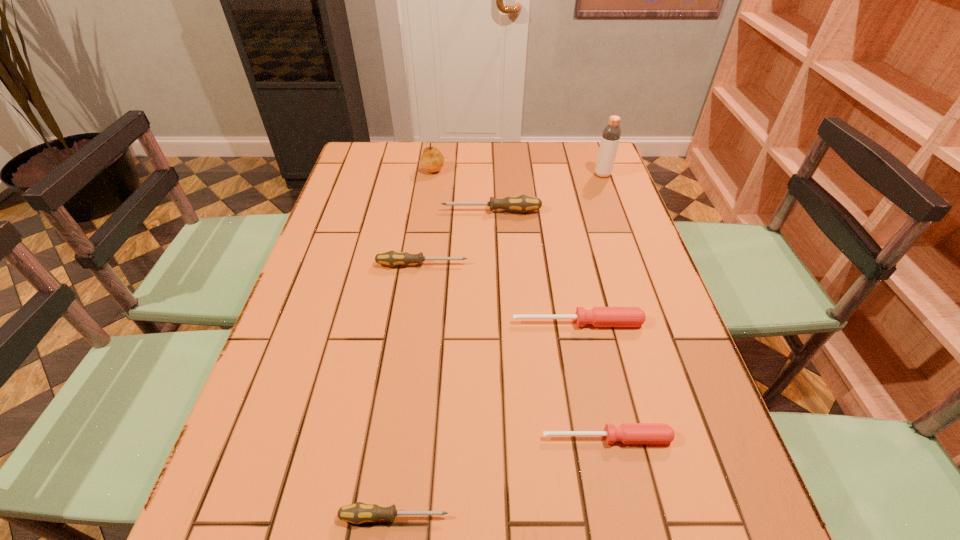
Image resolution: width=960 pixels, height=540 pixels. Identify the location of free space located on the front of the smaller red screwdriver. (614, 474).

The width and height of the screenshot is (960, 540). In order to click on vacant space located 0.080m at the tip of the nearest object in this screenshot , I will do `click(497, 516)`.

Image resolution: width=960 pixels, height=540 pixels. I want to click on bottle located in the far edge section of the desktop, so click(611, 133).

Identify the location of pear that is at the far edge. This screenshot has height=540, width=960. (432, 160).

Where is `object that is at the near edge`? object that is at the near edge is located at coordinates (357, 513).

The image size is (960, 540). What are the coordinates of `bottle that is at the right edge` in the screenshot? It's located at (611, 133).

Where is `object that is positioned at the far right corner`? object that is positioned at the far right corner is located at coordinates (611, 133).

Image resolution: width=960 pixels, height=540 pixels. What are the coordinates of `vacant region at the far edge` in the screenshot? It's located at (479, 173).

Identify the location of free region at the left edge. The height and width of the screenshot is (540, 960). (311, 253).

In the image, there is a desktop. In order to click on free space at the right edge in this screenshot , I will do `click(625, 288)`.